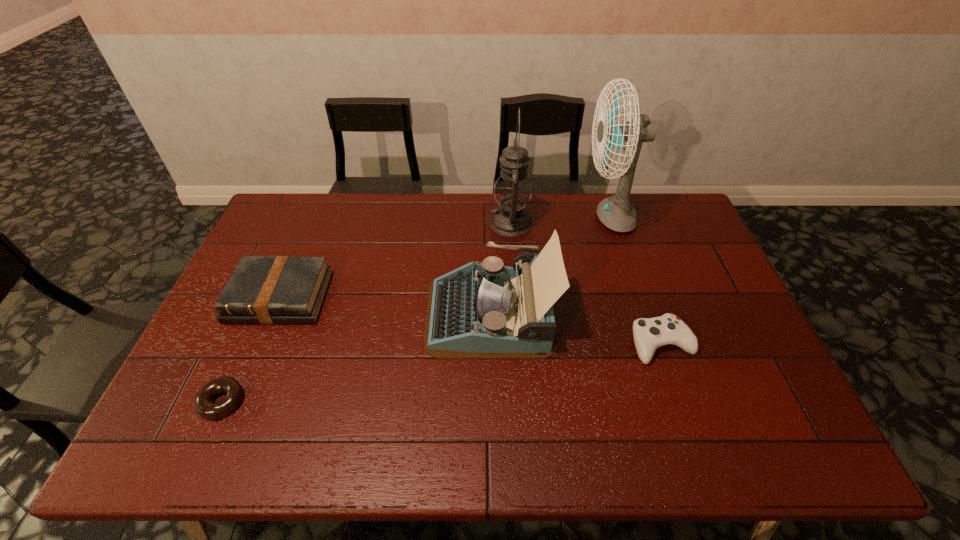
Identify the location of hardback book present at the left edge. (262, 289).

Where is `doughnut that is at the left edge`? This screenshot has width=960, height=540. doughnut that is at the left edge is located at coordinates (203, 404).

Identify the location of object present at the near left corner. (203, 404).

Image resolution: width=960 pixels, height=540 pixels. What are the coordinates of `vacant region at the far edge of the desktop` in the screenshot? It's located at (585, 228).

You are a GUI agent. You are given a task and a screenshot of the screen. Output one action in this format:
    pyautogui.click(x=<x>, y=<y>)
    Task: Click on the free space at the near edge of the desktop
    Image resolution: width=960 pixels, height=540 pixels.
    Given the screenshot: What is the action you would take?
    pyautogui.click(x=331, y=427)

In the image, there is a desktop. Where is `vacant space at the right edge`? Image resolution: width=960 pixels, height=540 pixels. vacant space at the right edge is located at coordinates (669, 241).

The width and height of the screenshot is (960, 540). What are the coordinates of `free space at the far left corner of the desktop` in the screenshot? It's located at (314, 220).

The width and height of the screenshot is (960, 540). I want to click on free space between the control and the doughnut, so tap(442, 373).

The width and height of the screenshot is (960, 540). Identify the location of free space between the second shortest object and the typewriter. (576, 328).

Identify the location of vacant area that lies between the third tallest object and the fourth tallest object. Image resolution: width=960 pixels, height=540 pixels. (385, 305).